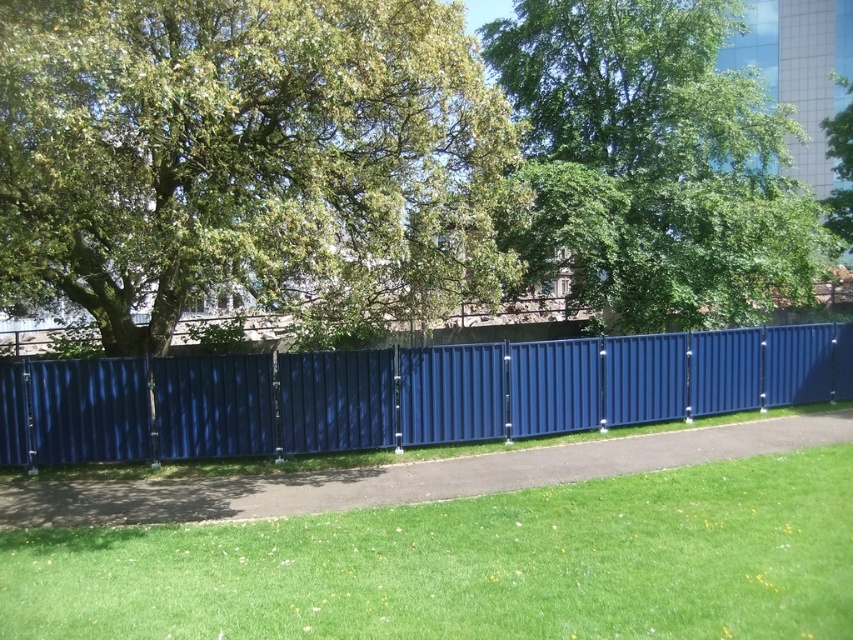
You are a park visitor trying to determine if the green leafy tree at upper center can provide shade over the metallic blue fence at center during midday. Based on their sizes, is the tree large enough to cover the fence?

The green leafy tree at upper center is larger in size than the metallic blue fence at center, so it is likely large enough to provide shade over the fence during midday.

You are a gardener who needs to mow the lawn. You see the green grass at lower center and the green leafy tree at upper center. Which object is closer to the ground?

The green grass at lower center is closer to the ground because it is shorter than the green leafy tree at upper center.